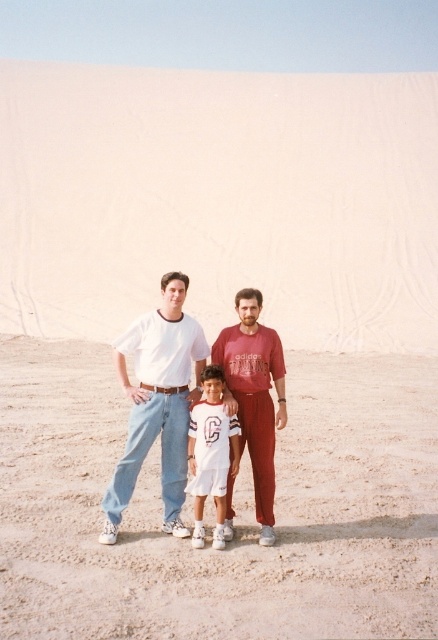
You are standing in the desert scene and want to walk from point A to point B. Point A is located at coordinates point (18, 483) and point B is at point (189, 348). Which direction should you face to move from point A to point B?

Since point (18, 483) is closer to you than point (189, 348), you should face towards the direction that is away from you to reach point B from point A.